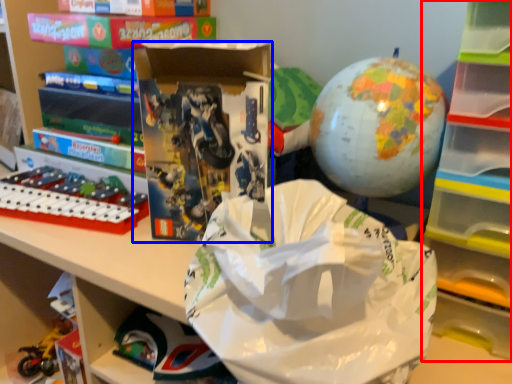
Question: Which point is further to the camera, bookshelf (highlighted by a red box) or book (highlighted by a blue box)?

Choices:
 (A) bookshelf
 (B) book

Answer: (B)